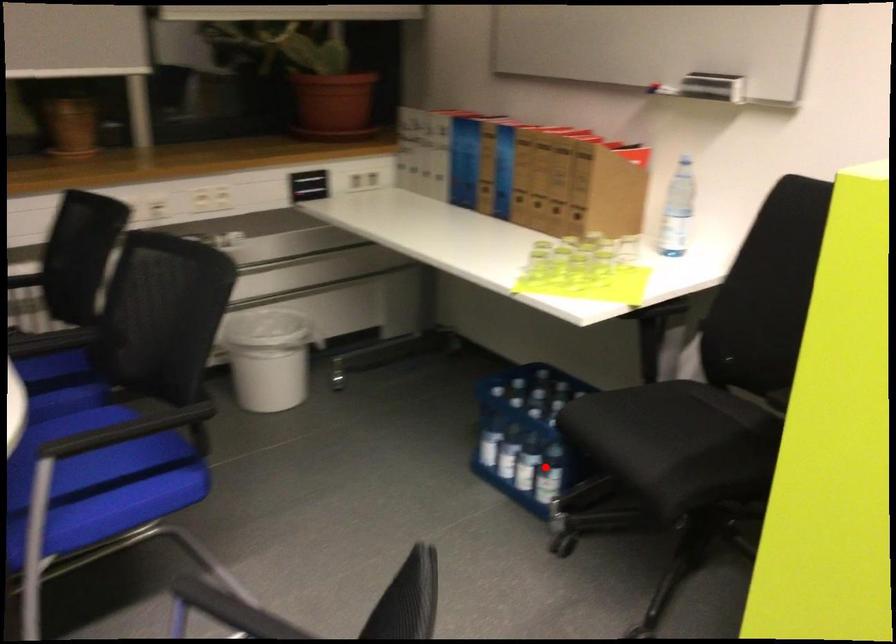
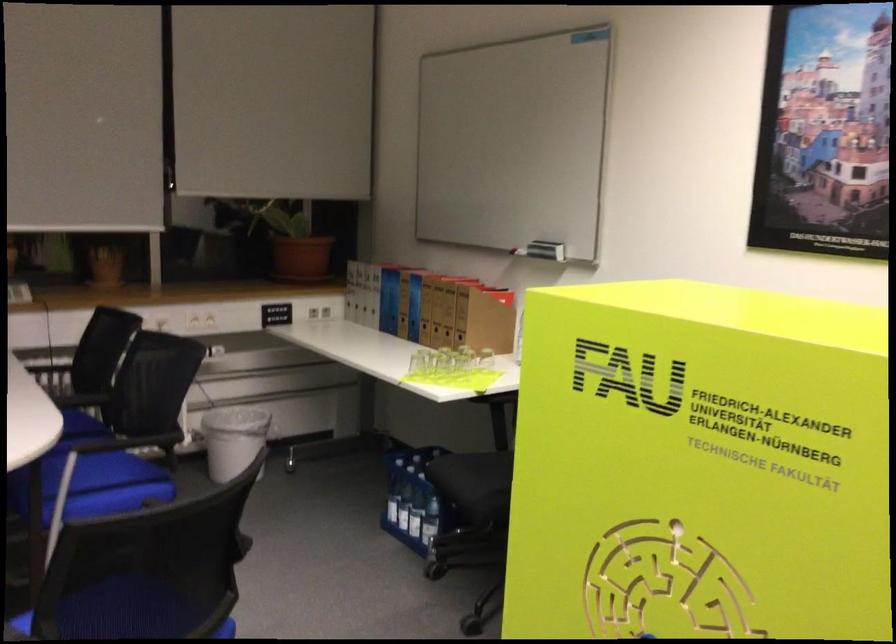
Question: I am providing you with two images of the same scene from different viewpoints. In image1, a red point is highlighted. Considering the same 3D point in image2, which of the following is correct?

Choices:
 (A) It is closer
 (B) It is farther

Answer: (B)